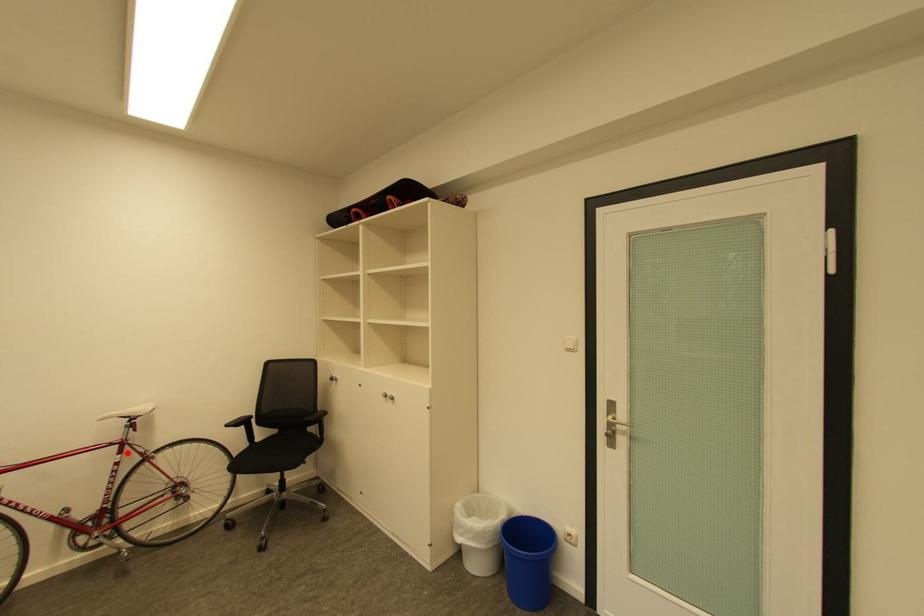
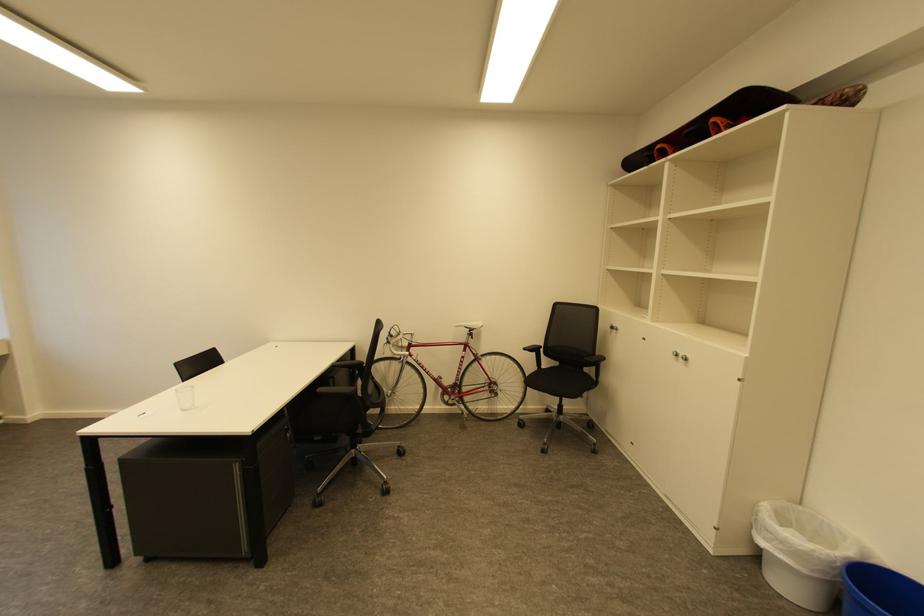
Question: I am providing you with two images of the same scene from different viewpoints. In image1, a red point is highlighted. Considering the same 3D point in image2, which of the following is correct?

Choices:
 (A) It is closer
 (B) It is farther

Answer: (B)